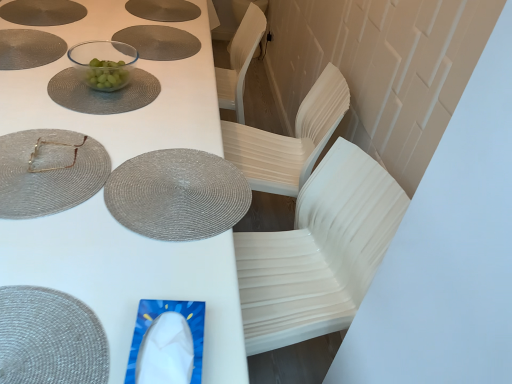
Find the location of a particular element. This screenshot has width=512, height=384. vacant space that is in between matte woven placemat at upper left, arranged as the 1th glass plate when ordered from the bottom, and matte gray placemat at upper center, which appears as the first plate when viewed from the right is located at coordinates (106, 93).